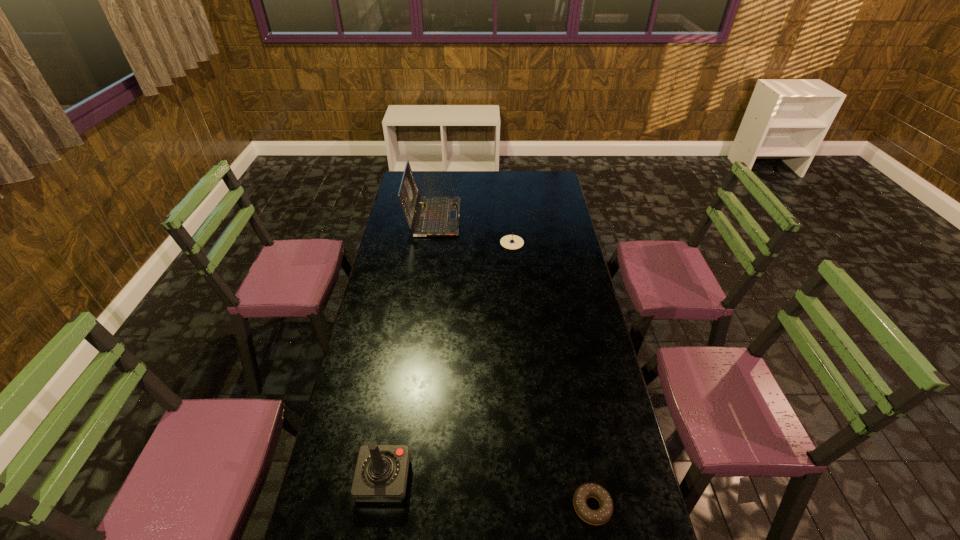
Where is `vacant area in the image that satisfies the following two spatial constraints: 1. on the screen of the compass; 2. on the left side of the laptop computer`? The image size is (960, 540). vacant area in the image that satisfies the following two spatial constraints: 1. on the screen of the compass; 2. on the left side of the laptop computer is located at coordinates (430, 242).

This screenshot has width=960, height=540. In order to click on vacant space that satisfies the following two spatial constraints: 1. on the front-facing side of the rightmost object; 2. on the left side of the joystick in this screenshot , I will do `click(379, 507)`.

Find the location of a particular element. This screenshot has height=540, width=960. vacant position in the image that satisfies the following two spatial constraints: 1. on the screen of the laptop computer; 2. on the left side of the second object from right to left is located at coordinates (430, 242).

Where is `free point that satisfies the following two spatial constraints: 1. on the screen of the laptop computer; 2. on the back side of the rightmost object`? The height and width of the screenshot is (540, 960). free point that satisfies the following two spatial constraints: 1. on the screen of the laptop computer; 2. on the back side of the rightmost object is located at coordinates (395, 507).

Find the location of a particular element. free point that satisfies the following two spatial constraints: 1. on the front-facing side of the doughnut; 2. on the left side of the second tallest object is located at coordinates (379, 507).

Locate an element on the screen. The width and height of the screenshot is (960, 540). blank area in the image that satisfies the following two spatial constraints: 1. on the screen of the second shortest object; 2. on the left side of the tallest object is located at coordinates (430, 242).

The image size is (960, 540). What are the coordinates of `vacant area in the image that satisfies the following two spatial constraints: 1. on the screen of the rightmost object; 2. on the right side of the laptop computer` in the screenshot? It's located at (395, 507).

You are a GUI agent. You are given a task and a screenshot of the screen. Output one action in this format:
    pyautogui.click(x=<x>, y=<y>)
    Task: Click on the vacant point that satisfies the following two spatial constraints: 1. on the screen of the shortest object; 2. on the left side of the laptop computer
    Image resolution: width=960 pixels, height=540 pixels.
    Given the screenshot: What is the action you would take?
    pyautogui.click(x=395, y=507)